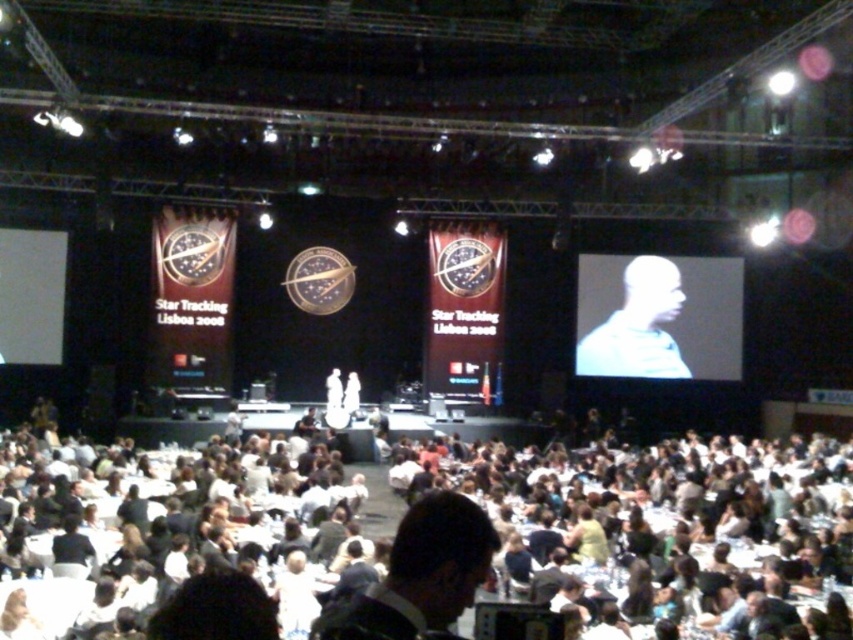
Question: Among these objects, which one is farthest from the camera?

Choices:
 (A) white matte screen at upper right
 (B) white matte projection screen at left
 (C) dark brown hair at center

Answer: (A)

Question: Among these points, which one is nearest to the camera?

Choices:
 (A) (587, 273)
 (B) (476, 547)
 (C) (55, 324)
 (D) (669, 614)

Answer: (B)

Question: Where is white cloth-covered tables at lower center located in relation to white matte projection screen at left in the image?

Choices:
 (A) below
 (B) above

Answer: (A)

Question: Is white cloth-covered tables at lower center above dark brown hair at center?

Choices:
 (A) yes
 (B) no

Answer: (B)

Question: Which object appears farthest from the camera in this image?

Choices:
 (A) white cloth-covered tables at lower center
 (B) white matte screen at upper right
 (C) dark brown hair at center
 (D) white matte projection screen at left

Answer: (B)

Question: Does white matte screen at upper right have a greater width compared to dark brown hair at center?

Choices:
 (A) yes
 (B) no

Answer: (A)